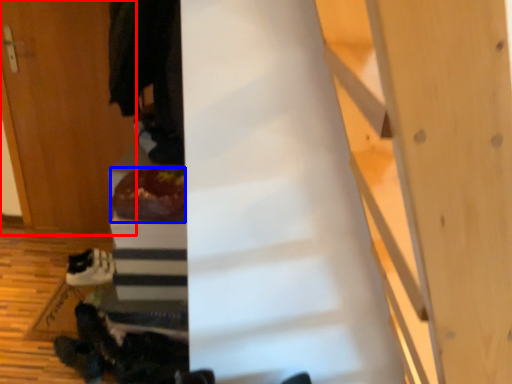
Question: Which point is further to the camera, door (highlighted by a red box) or food (highlighted by a blue box)?

Choices:
 (A) door
 (B) food

Answer: (A)